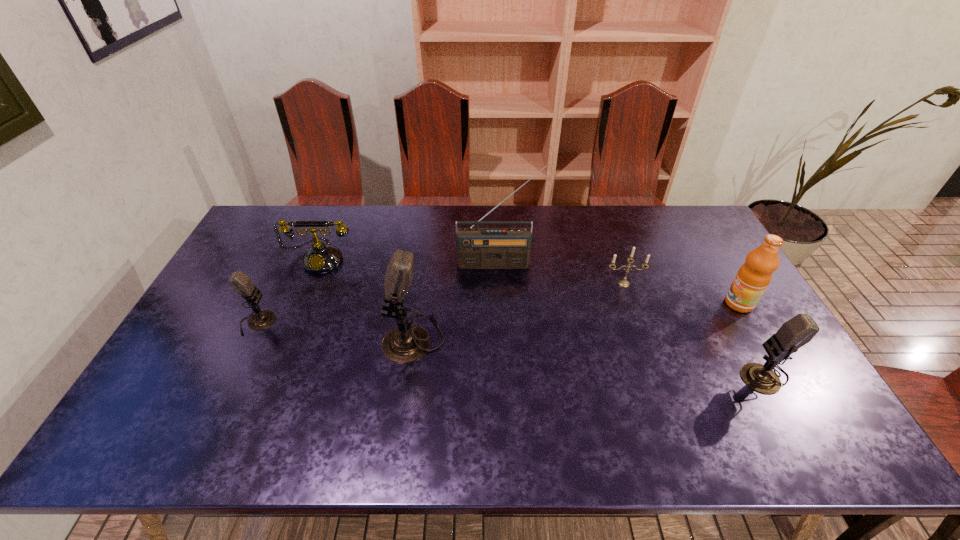
The height and width of the screenshot is (540, 960). In order to click on vacant point located between the telephone and the second microphone from right to left in this screenshot , I will do pyautogui.click(x=368, y=298).

Locate an element on the screen. This screenshot has height=540, width=960. vacant space that is in between the second tallest microphone and the radio receiver is located at coordinates (631, 319).

Identify the location of the fourth closest object relative to the fourth object from left to right. The height and width of the screenshot is (540, 960). point(241,283).

The height and width of the screenshot is (540, 960). What are the coordinates of `object that is the fourth closest to the fruit juice` in the screenshot? It's located at (406, 343).

You are a GUI agent. You are given a task and a screenshot of the screen. Output one action in this format:
    pyautogui.click(x=<x>, y=<y>)
    Task: Click on the microphone that is the second closest to the telephone
    Image resolution: width=960 pixels, height=540 pixels.
    Given the screenshot: What is the action you would take?
    pyautogui.click(x=406, y=343)

Identify which microphone is the closest to the telephone. Please provide its 2D coordinates. Your answer should be formatted as a tuple, i.e. [(x, y)], where the tuple contains the x and y coordinates of a point satisfying the conditions above.

[(241, 283)]

Where is `free space that satisfies the following two spatial constraints: 1. on the front-facing side of the fourth object from right to left; 2. on the front-facing side of the shortest microphone`? The image size is (960, 540). free space that satisfies the following two spatial constraints: 1. on the front-facing side of the fourth object from right to left; 2. on the front-facing side of the shortest microphone is located at coordinates (500, 323).

Where is `free spot that satisfies the following two spatial constraints: 1. on the dial of the third farthest object; 2. on the right side of the telephone`? free spot that satisfies the following two spatial constraints: 1. on the dial of the third farthest object; 2. on the right side of the telephone is located at coordinates (311, 284).

Find the location of a particular element. free location that satisfies the following two spatial constraints: 1. on the dial of the telephone; 2. on the right side of the candle is located at coordinates (311, 284).